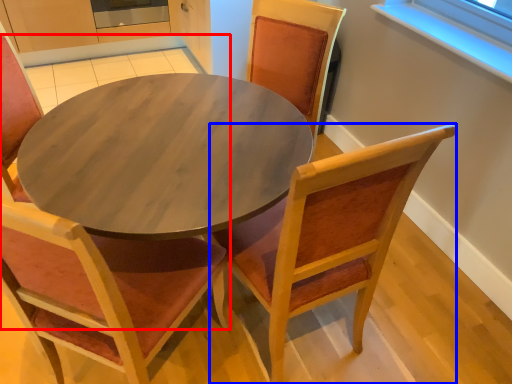
Question: Which point is further to the camera, chair (highlighted by a red box) or chair (highlighted by a blue box)?

Choices:
 (A) chair
 (B) chair

Answer: (B)